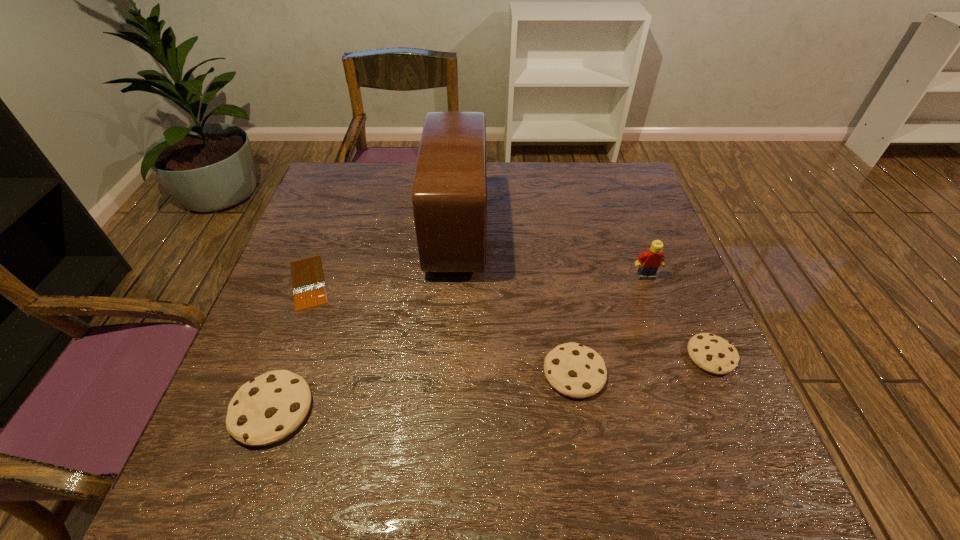
Where is `the tallest cookie`? The height and width of the screenshot is (540, 960). the tallest cookie is located at coordinates (268, 408).

In order to click on the third tallest object in this screenshot , I will do `click(268, 408)`.

Image resolution: width=960 pixels, height=540 pixels. I want to click on the third object from right to left, so click(574, 370).

I want to click on the second cookie from right to left, so click(x=574, y=370).

I want to click on the second shortest object, so click(713, 354).

I want to click on the rightmost cookie, so click(713, 354).

Locate an element on the screen. Image resolution: width=960 pixels, height=540 pixels. the tallest object is located at coordinates (449, 197).

Identify the location of the third object from left to right. The height and width of the screenshot is (540, 960). pyautogui.click(x=449, y=197).

Find the location of a particular element. The height and width of the screenshot is (540, 960). the fifth shortest object is located at coordinates (649, 262).

Find the location of a particular element. chocolate bar is located at coordinates (308, 283).